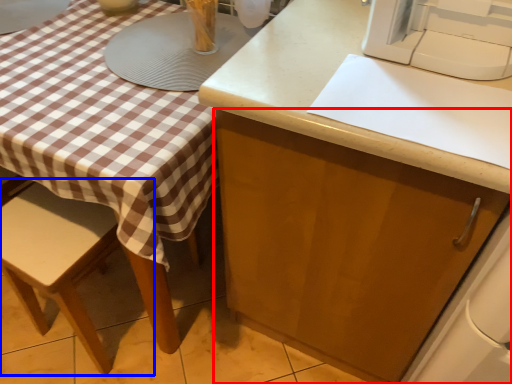
Question: Which object is further to the camera taking this photo, cabinetry (highlighted by a red box) or chair (highlighted by a blue box)?

Choices:
 (A) cabinetry
 (B) chair

Answer: (B)